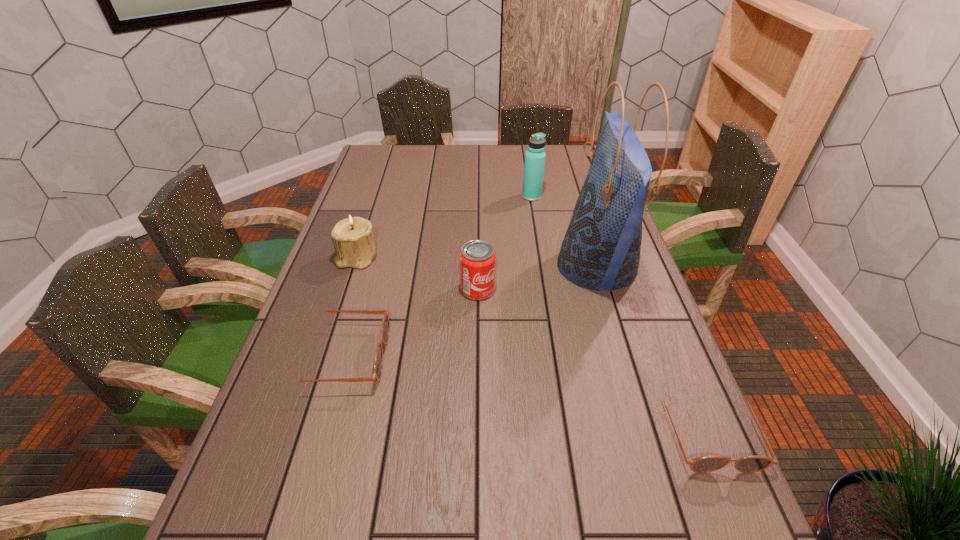
Image resolution: width=960 pixels, height=540 pixels. I want to click on object that is positioned at the near right corner, so click(750, 464).

The height and width of the screenshot is (540, 960). What are the coordinates of `vacant space at the far edge of the desktop` in the screenshot? It's located at [444, 151].

The height and width of the screenshot is (540, 960). Find the location of `blank space at the near edge of the desktop`. blank space at the near edge of the desktop is located at coordinates click(x=632, y=470).

This screenshot has height=540, width=960. Find the location of `free point at the left edge`. free point at the left edge is located at coordinates (327, 415).

Identify the location of vacant region at the right edge of the desktop. (698, 408).

The width and height of the screenshot is (960, 540). Find the location of `free space at the far right corner of the desktop`. free space at the far right corner of the desktop is located at coordinates (579, 170).

Find the location of a particular element. free space between the farthest object and the can is located at coordinates (505, 242).

The width and height of the screenshot is (960, 540). Find the location of `vacant space that's between the candle_holder and the thermos bottle`. vacant space that's between the candle_holder and the thermos bottle is located at coordinates (444, 227).

You are a GUI agent. You are given a task and a screenshot of the screen. Output one action in this format:
    pyautogui.click(x=<x>, y=<y>)
    Task: Click on the vacant space in between the nearest object and the third shortest object
    
    Given the screenshot: What is the action you would take?
    pyautogui.click(x=593, y=360)

Locate an element on the screen. vacant space in between the right sunglasses and the candle_holder is located at coordinates (533, 344).